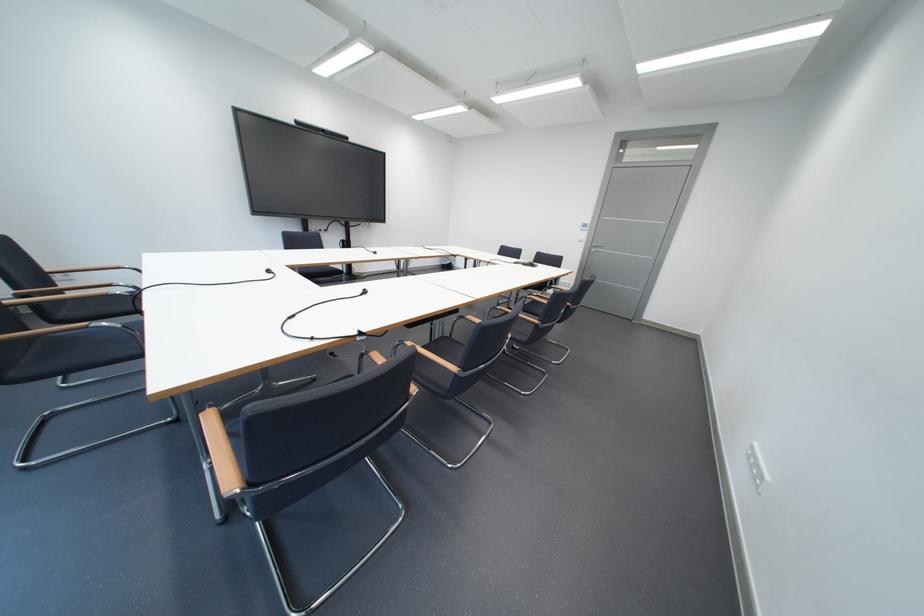
What do you see at coordinates (757, 467) in the screenshot? The height and width of the screenshot is (616, 924). I see `the silver door handle` at bounding box center [757, 467].